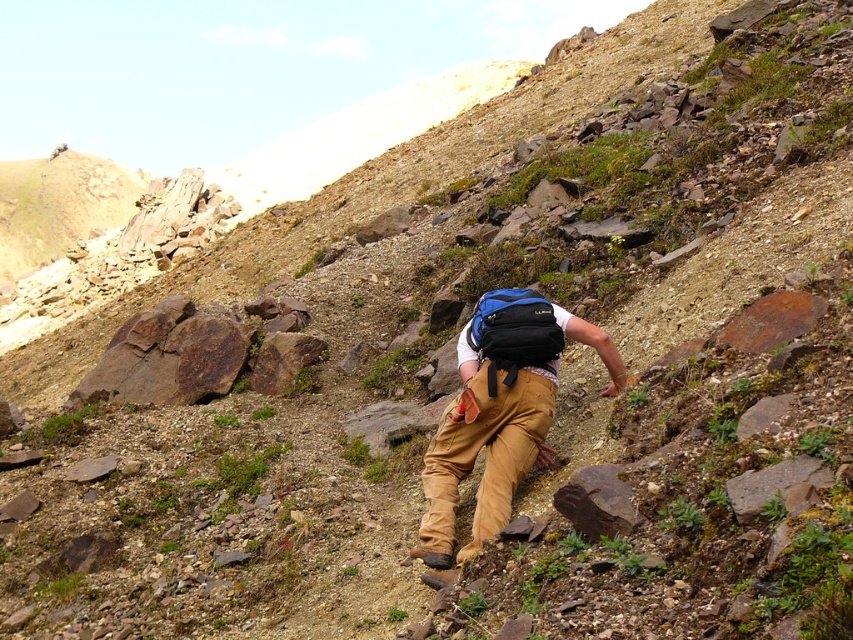
Image resolution: width=853 pixels, height=640 pixels. What do you see at coordinates (498, 412) in the screenshot?
I see `matte black backpack at center` at bounding box center [498, 412].

Which is behind, point (519, 481) or point (611, 513)?

The point (519, 481) is more distant.

Between point (480, 508) and point (573, 488), which one is positioned in front?

Point (573, 488) is in front.

Locate an element on the screen. This screenshot has height=640, width=853. matte black backpack at center is located at coordinates (498, 412).

Between khaki pants at center and blue fabric backpack at center, which one is positioned higher?

Positioned higher is blue fabric backpack at center.

Is khaki pants at center wider than blue fabric backpack at center?

Yes, khaki pants at center is wider than blue fabric backpack at center.

Does point (541, 394) lie in front of point (547, 364)?

That is True.

Find the location of a particular element. khaki pants at center is located at coordinates (485, 460).

Between point (525, 342) and point (581, 509), which one is positioned behind?

Positioned behind is point (525, 342).

Can you confirm if blue fabric backpack at center is thinner than rusty metallic rock at lower center?

No.

This screenshot has height=640, width=853. In order to click on blue fabric backpack at center in this screenshot , I will do `click(514, 333)`.